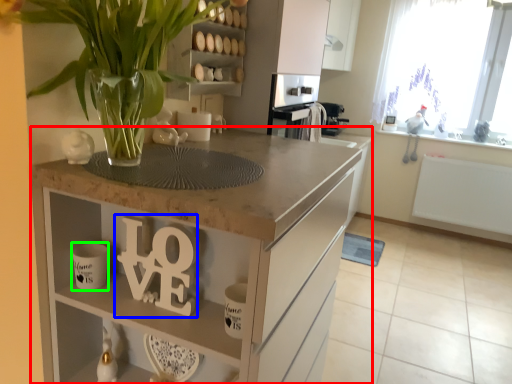
Question: Which is nearer to the countertop (highlighted by a red box)? alphabet (highlighted by a blue box) or mug (highlighted by a green box).

Choices:
 (A) alphabet
 (B) mug

Answer: (A)